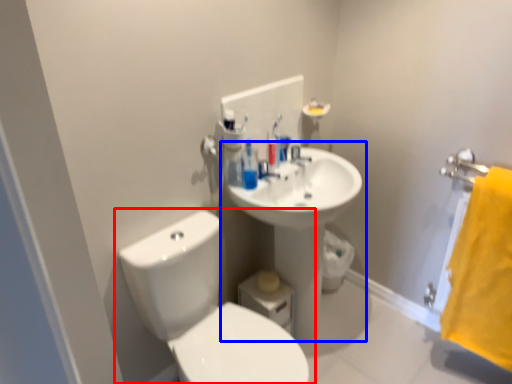
Question: Which object is closer to the camera taking this photo, toilet (highlighted by a red box) or sink (highlighted by a blue box)?

Choices:
 (A) toilet
 (B) sink

Answer: (A)